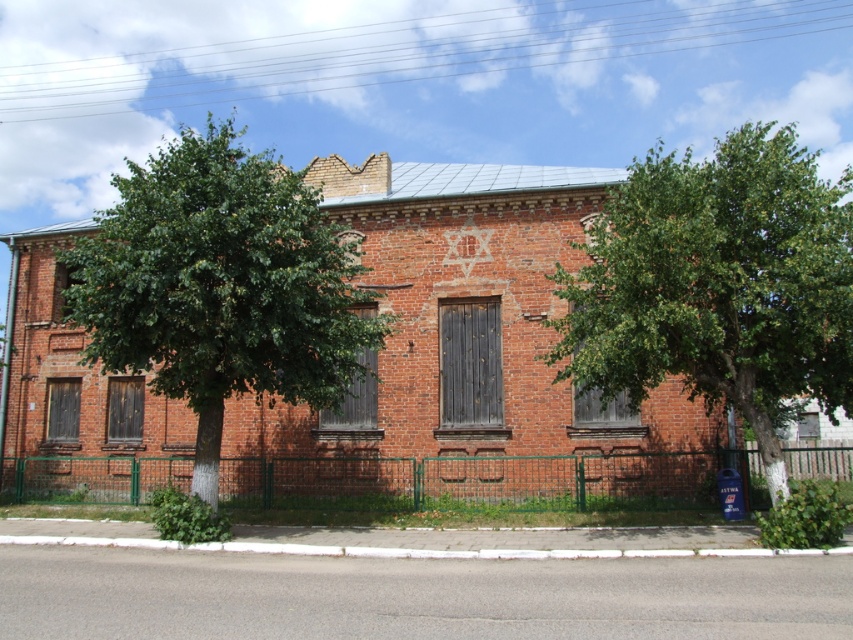
Is green leafy tree at right above green leafy tree at left?

Indeed, green leafy tree at right is positioned over green leafy tree at left.

Which of these two, green leafy tree at right or green leafy tree at left, stands taller?

green leafy tree at left is taller.

Locate an element on the screen. The height and width of the screenshot is (640, 853). green leafy tree at right is located at coordinates (718, 284).

The height and width of the screenshot is (640, 853). Find the location of `green leafy tree at right`. green leafy tree at right is located at coordinates (718, 284).